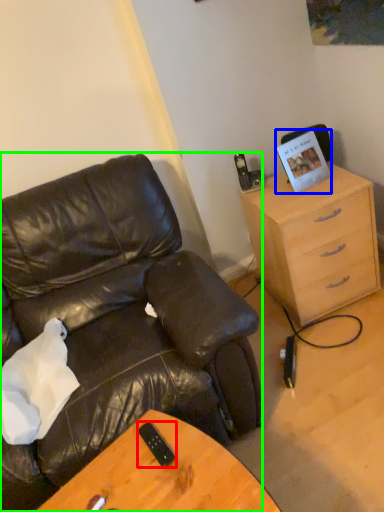
Question: Which is nearer to the mobile phone (highlighted by a red box)? picture frame (highlighted by a blue box) or chair (highlighted by a green box).

Choices:
 (A) picture frame
 (B) chair

Answer: (B)